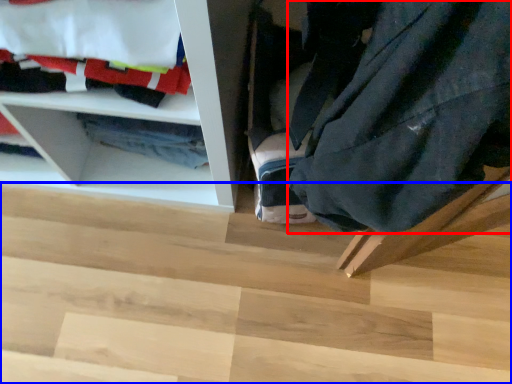
Question: Which object is closer to the camera taking this photo, clothing (highlighted by a red box) or stair (highlighted by a blue box)?

Choices:
 (A) clothing
 (B) stair

Answer: (A)